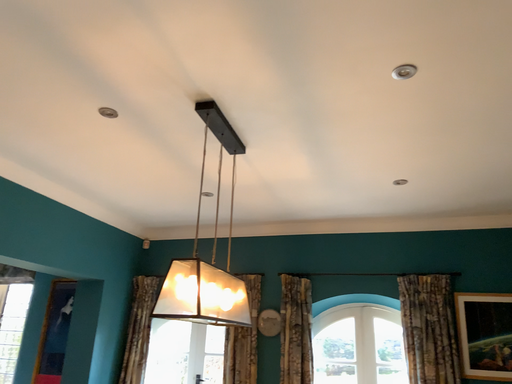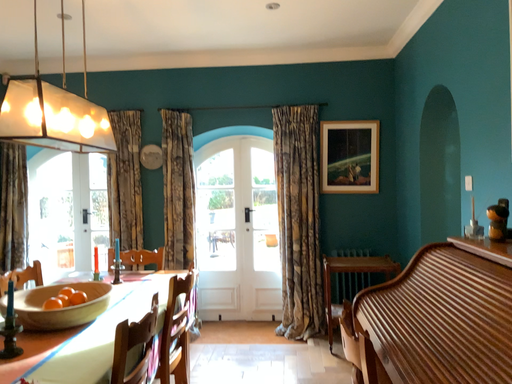
Question: Which way did the camera rotate in the video?

Choices:
 (A) rotated upward
 (B) rotated downward

Answer: (B)